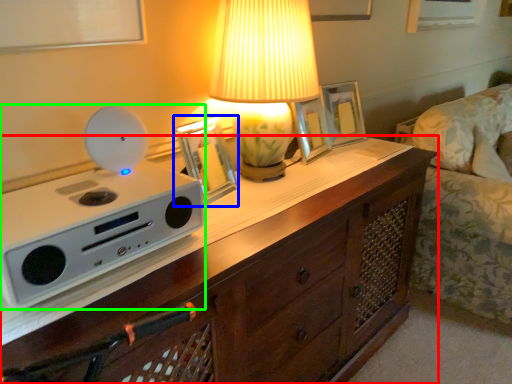
Question: Which object is the closest to the chest of drawers (highlighted by a red box)? Choose among these: picture frame (highlighted by a blue box) or appliance (highlighted by a green box).

Choices:
 (A) picture frame
 (B) appliance

Answer: (B)